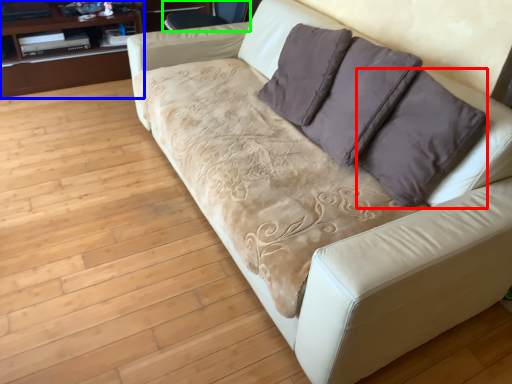
Question: Based on their relative distances, which object is nearer to throw pillow (highlighted by a red box)? Choose from dresser (highlighted by a blue box) and armchair (highlighted by a green box).

Choices:
 (A) dresser
 (B) armchair

Answer: (B)